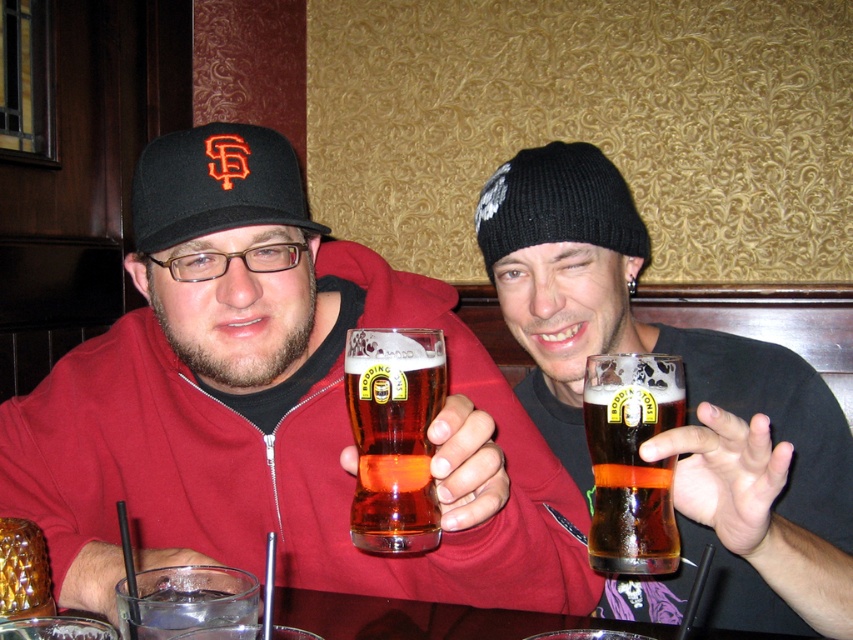
Question: Considering the real-world distances, which object is closest to the matte glass beer at center?

Choices:
 (A) matte black beanie at upper center
 (B) clear glass at lower left
 (C) brown glass beer at center
 (D) amber glass beer at center

Answer: (D)

Question: Is the position of amber glass beer at center more distant than that of black fabric baseball cap at left?

Choices:
 (A) no
 (B) yes

Answer: (A)

Question: Does amber glass beer at center have a smaller size compared to black fabric baseball cap at left?

Choices:
 (A) yes
 (B) no

Answer: (A)

Question: Which of the following is the closest to the observer?

Choices:
 (A) amber glass beer at center
 (B) brown glass beer at center
 (C) black fabric baseball cap at left

Answer: (B)

Question: Which object is positioned closest to the brown glass beer at center?

Choices:
 (A) black fabric baseball cap at left
 (B) clear glass at lower left
 (C) matte glass beer at center

Answer: (B)

Question: Does amber glass beer at center appear under black fabric baseball cap at left?

Choices:
 (A) yes
 (B) no

Answer: (A)